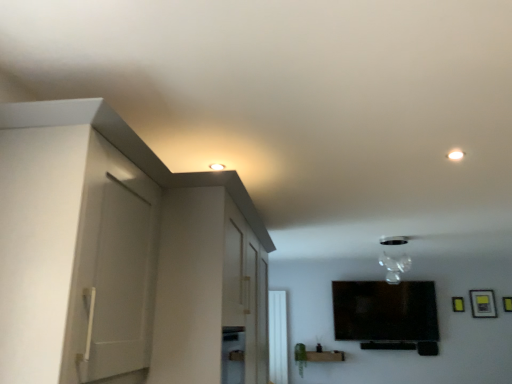
What do you see at coordinates (395, 265) in the screenshot? The height and width of the screenshot is (384, 512). I see `transparent glass vase at upper center` at bounding box center [395, 265].

In order to face yellow matte picture frame at upper right, which appears as the first picture frame when viewed from the left, should I rotate leftwards or rightwards?

It's best to rotate right around 25.614 degrees.

What do you see at coordinates (115, 252) in the screenshot? I see `white matte cabinet at left` at bounding box center [115, 252].

This screenshot has height=384, width=512. Identify the location of matte black vase at lower center. (324, 356).

What do you see at coordinates (483, 303) in the screenshot? I see `matte black picture frame at upper right, the first picture frame positioned from the right` at bounding box center [483, 303].

I want to click on matte black picture frame at upper right, the first picture frame positioned from the right, so click(x=483, y=303).

Locate an element on the screen. white glossy window at center is located at coordinates (278, 337).

Between yellow matte picture frame at upper right, which is the second picture frame from right to left, and matte black vase at lower center, which one appears on the right side from the viewer's perspective?

yellow matte picture frame at upper right, which is the second picture frame from right to left, is more to the right.

Considering the points (456, 301) and (336, 351), which point is behind, point (456, 301) or point (336, 351)?

The point (336, 351) is behind.

From a real-world perspective, which object rests below the other?

In real-world perspective, matte black vase at lower center is lower.

Can you confirm if white glossy window at center is thinner than transparent glass vase at upper center?

Yes, white glossy window at center is thinner than transparent glass vase at upper center.

Which of these two, white glossy window at center or transparent glass vase at upper center, is smaller?

white glossy window at center.

Considering the relative positions of white glossy window at center and transparent glass vase at upper center in the image provided, is white glossy window at center in front of transparent glass vase at upper center?

No.

Is transparent glass vase at upper center inside the boundaries of matte black picture frame at upper right, the first picture frame positioned from the right, or outside?

transparent glass vase at upper center exists outside the volume of matte black picture frame at upper right, the first picture frame positioned from the right.

Is the surface of transparent glass vase at upper center in direct contact with matte black picture frame at upper right, the first picture frame positioned from the right?

transparent glass vase at upper center is not next to matte black picture frame at upper right, the first picture frame positioned from the right, and they're not touching.

From a real-world perspective, is transparent glass vase at upper center physically below matte black picture frame at upper right, arranged as the second picture frame when viewed from the left?

No, from a real-world perspective, transparent glass vase at upper center is not under matte black picture frame at upper right, arranged as the second picture frame when viewed from the left.

In the scene shown: How different are the orientations of transparent glass vase at upper center and matte black picture frame at upper right, the first picture frame positioned from the right, in degrees?

The angle between the facing direction of transparent glass vase at upper center and the facing direction of matte black picture frame at upper right, the first picture frame positioned from the right, is 5.28 degrees.

Is white matte cabinet at left positioned far away from matte black picture frame at upper right, arranged as the second picture frame when viewed from the left?

Yes, white matte cabinet at left and matte black picture frame at upper right, arranged as the second picture frame when viewed from the left, are located far from each other.

Considering the relative positions of white matte cabinet at left and matte black picture frame at upper right, the first picture frame positioned from the right, in the image provided, is white matte cabinet at left behind matte black picture frame at upper right, the first picture frame positioned from the right,?

No.

From a real-world perspective, is white matte cabinet at left below matte black picture frame at upper right, the first picture frame positioned from the right?

Yes.

From the image's perspective, which one is positioned higher, white matte cabinet at left or matte black picture frame at upper right, the first picture frame positioned from the right?

white matte cabinet at left, from the image's perspective.

Does point (279, 333) come in front of point (489, 305)?

That is False.

Does white glossy window at center have a larger size compared to matte black picture frame at upper right, the first picture frame positioned from the right?

Yes, white glossy window at center is bigger than matte black picture frame at upper right, the first picture frame positioned from the right.

Considering the relative positions of white glossy window at center and matte black picture frame at upper right, the first picture frame positioned from the right, in the image provided, is white glossy window at center behind matte black picture frame at upper right, the first picture frame positioned from the right,?

Yes, white glossy window at center is further from the viewer.

This screenshot has height=384, width=512. Identify the location of window beneath the matte black picture frame at upper right, the first picture frame positioned from the right (from a real-world perspective). (278, 337).

Is white glossy window at center oriented towards yellow matte picture frame at upper right, which is the second picture frame from right to left?

No.

Who is shorter, white glossy window at center or yellow matte picture frame at upper right, which is the second picture frame from right to left?

With less height is yellow matte picture frame at upper right, which is the second picture frame from right to left.

Based on the photo, which object is further away from the camera, matte black vase at lower center or white matte cabinet at left?

matte black vase at lower center is behind.

Does matte black vase at lower center have a greater width compared to white matte cabinet at left?

No, matte black vase at lower center is not wider than white matte cabinet at left.

From the image's perspective, between matte black vase at lower center and white matte cabinet at left, who is located below?

matte black vase at lower center.

Is matte black vase at lower center to the left or to the right of white matte cabinet at left in the image?

In the image, matte black vase at lower center appears on the right side of white matte cabinet at left.

Identify the location of the 1st picture frame above the matte black vase at lower center (from the image's perspective). Image resolution: width=512 pixels, height=384 pixels. (458, 304).

In order to click on window lying behind the transparent glass vase at upper center in this screenshot , I will do `click(278, 337)`.

Estimate the real-world distances between objects in this image. Which object is closer to yellow matte picture frame at upper right, which is the second picture frame from right to left, transparent glass vase at upper center or white matte cabinet at left?

transparent glass vase at upper center lies closer to yellow matte picture frame at upper right, which is the second picture frame from right to left, than the other object.

When comparing their distances from matte black vase at lower center, does matte black picture frame at upper right, the first picture frame positioned from the right, or white matte cabinet at left seem closer?

matte black picture frame at upper right, the first picture frame positioned from the right.

When comparing their distances from yellow matte picture frame at upper right, which appears as the first picture frame when viewed from the left, does white glossy window at center or matte black vase at lower center seem further?

white glossy window at center is further to yellow matte picture frame at upper right, which appears as the first picture frame when viewed from the left.

Which object lies nearer to the anchor point white matte cabinet at left, white glossy window at center or matte black picture frame at upper right, arranged as the second picture frame when viewed from the left?

white glossy window at center is closer to white matte cabinet at left.

Looking at the image, which one is located closer to white matte cabinet at left, matte black vase at lower center or transparent glass vase at upper center?

transparent glass vase at upper center.

Estimate the real-world distances between objects in this image. Which object is further from white matte cabinet at left, matte black vase at lower center or yellow matte picture frame at upper right, which is the second picture frame from right to left?

yellow matte picture frame at upper right, which is the second picture frame from right to left.

From the image, which object appears to be nearer to white glossy window at center, matte black vase at lower center or yellow matte picture frame at upper right, which is the second picture frame from right to left?

matte black vase at lower center lies closer to white glossy window at center than the other object.

Which object lies further to the anchor point transparent glass vase at upper center, yellow matte picture frame at upper right, which appears as the first picture frame when viewed from the left, or matte black picture frame at upper right, the first picture frame positioned from the right?

yellow matte picture frame at upper right, which appears as the first picture frame when viewed from the left, is positioned further to the anchor transparent glass vase at upper center.

Where is `furniture between transparent glass vase at upper center and white glossy window at center from front to back`? This screenshot has width=512, height=384. furniture between transparent glass vase at upper center and white glossy window at center from front to back is located at coordinates (324, 356).

This screenshot has width=512, height=384. What are the coordinates of `furniture positioned between white matte cabinet at left and matte black picture frame at upper right, the first picture frame positioned from the right, from near to far` in the screenshot? It's located at (324, 356).

Where is `furniture situated between white glossy window at center and yellow matte picture frame at upper right, which appears as the first picture frame when viewed from the left, from left to right`? furniture situated between white glossy window at center and yellow matte picture frame at upper right, which appears as the first picture frame when viewed from the left, from left to right is located at coordinates (324, 356).

Where is `window positioned between white matte cabinet at left and yellow matte picture frame at upper right, which appears as the first picture frame when viewed from the left, from near to far`? Image resolution: width=512 pixels, height=384 pixels. window positioned between white matte cabinet at left and yellow matte picture frame at upper right, which appears as the first picture frame when viewed from the left, from near to far is located at coordinates (278, 337).